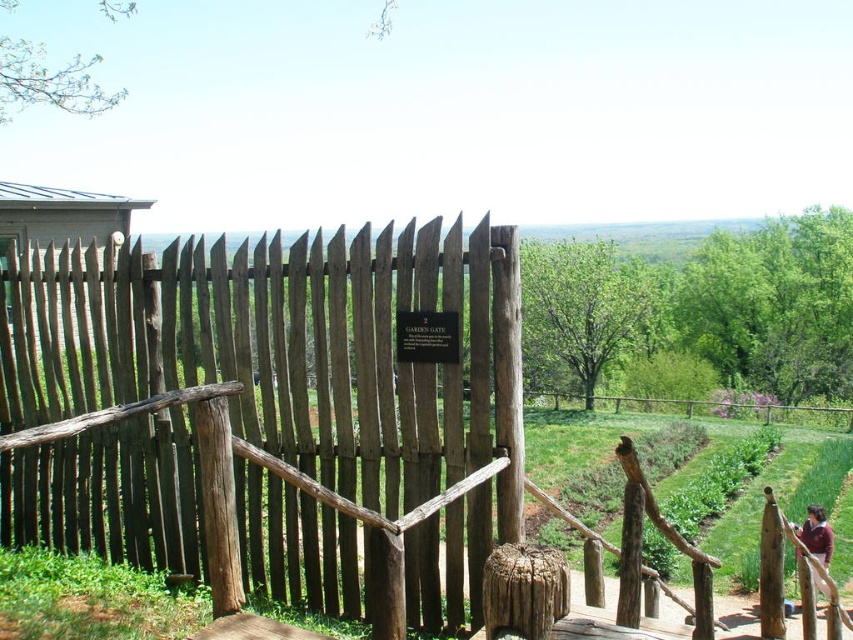
You are designing a garden layout and need to place a new bench. The bench requires a space wider than the maroon fabric at lower right. Can the gray wooden fence at center provide enough width for the bench?

The gray wooden fence at center is wider than the maroon fabric at lower right. Since the bench requires a space wider than the maroon fabric at lower right, the gray wooden fence at center can provide enough width for the bench.